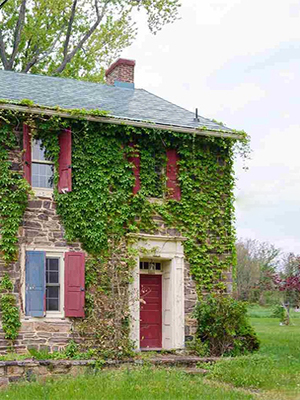
Identify the location of shutters. The width and height of the screenshot is (300, 400). (135, 154), (70, 290), (35, 288), (27, 149), (65, 142), (171, 166).